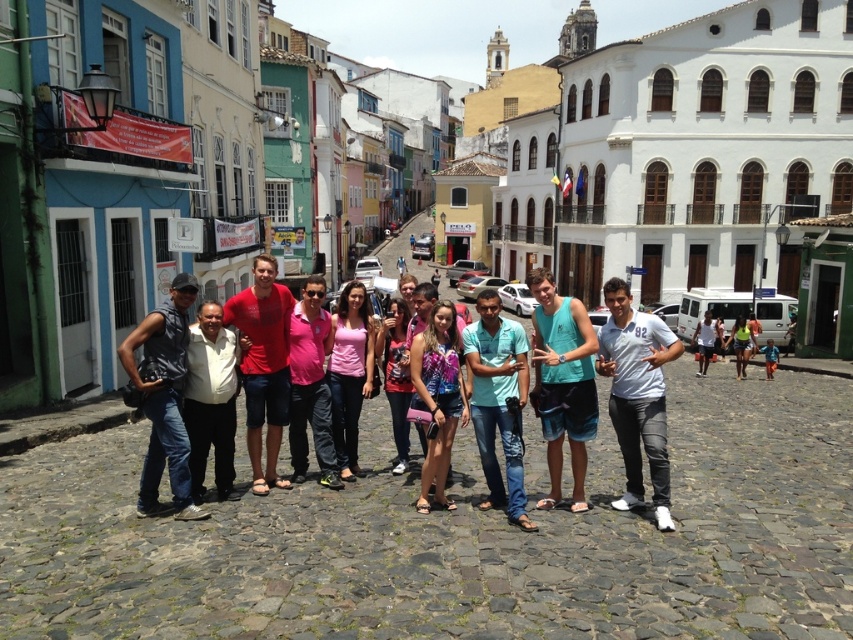
Question: Which point is farther from the camera taking this photo?

Choices:
 (A) (230, 426)
 (B) (836, 339)
 (C) (181, 451)
 (D) (360, 378)

Answer: (B)

Question: Does white matte t-shirt at center appear under dark gray suit at center?

Choices:
 (A) no
 (B) yes

Answer: (A)

Question: Can you confirm if white matte t-shirt at center is smaller than matte pink shirt at center?

Choices:
 (A) no
 (B) yes

Answer: (A)

Question: Which of these objects is positioned farthest from the pink matte tank top at center?

Choices:
 (A) patterned fabric dress at center
 (B) light blue denim jeans at center
 (C) matte pink shirt at center

Answer: (B)

Question: Which point appears closest to the camera in this image?

Choices:
 (A) (793, 278)
 (B) (434, 458)
 (C) (351, 454)
 (D) (506, 509)

Answer: (D)

Question: Does pink matte tank top at center have a greater width compared to white cotton shirt at center?

Choices:
 (A) yes
 (B) no

Answer: (A)